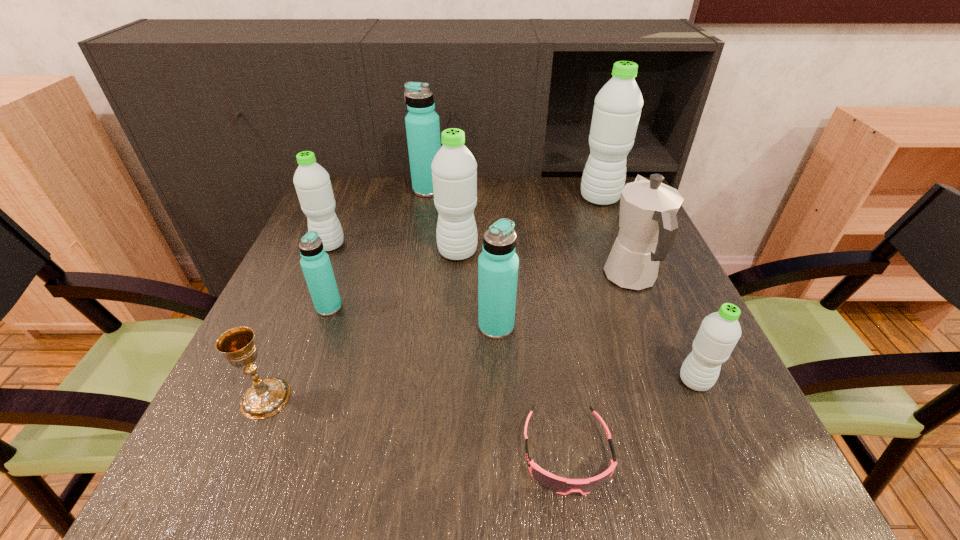
Identify the location of free space located 0.180m on the back of the third biggest green water bottle. The image size is (960, 540). (349, 199).

Locate an element on the screen. vacant area located on the left of the third water bottle from right to left is located at coordinates (353, 326).

Locate an element on the screen. The image size is (960, 540). vacant area situated on the front of the smallest blue water bottle is located at coordinates (259, 500).

Locate an element on the screen. Image resolution: width=960 pixels, height=540 pixels. vacant position located on the back of the nearest water bottle is located at coordinates (678, 342).

I want to click on free region located 0.050m on the back of the chalice, so click(283, 356).

Where is `object that is at the near edge`? object that is at the near edge is located at coordinates (560, 485).

Where is `chalice present at the left edge`? chalice present at the left edge is located at coordinates (265, 397).

Where is `coffeepot at the right edge`? coffeepot at the right edge is located at coordinates (648, 224).

Locate an element on the screen. Image resolution: width=960 pixels, height=540 pixels. object that is at the far right corner is located at coordinates (617, 109).

Where is `vacant area at the far edge`? This screenshot has height=540, width=960. vacant area at the far edge is located at coordinates (564, 187).